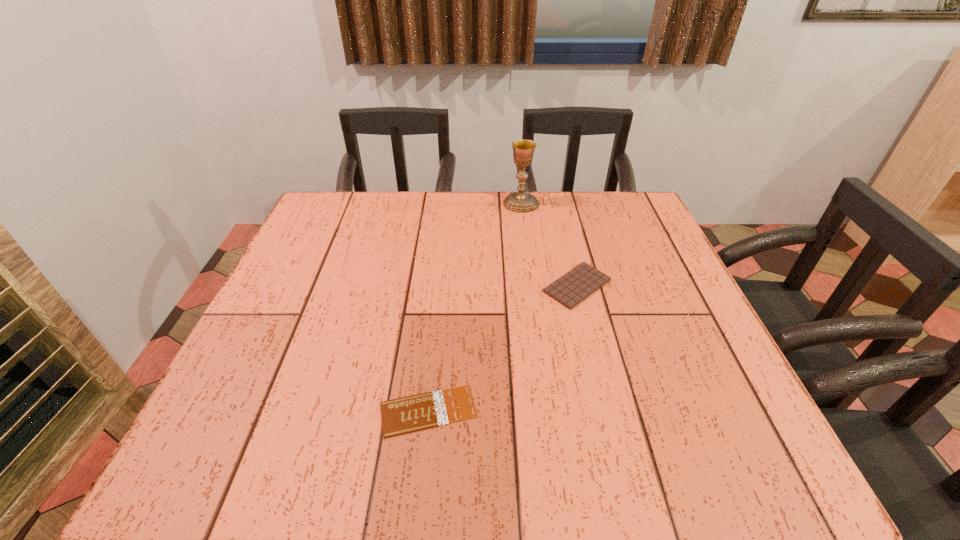
Locate an element on the screen. The width and height of the screenshot is (960, 540). free spot that satisfies the following two spatial constraints: 1. on the back side of the nearer chocolate bar; 2. on the left side of the farthest object is located at coordinates [449, 203].

The height and width of the screenshot is (540, 960). I want to click on blank area in the image that satisfies the following two spatial constraints: 1. on the back side of the second nearest object; 2. on the left side of the left chocolate bar, so (x=441, y=286).